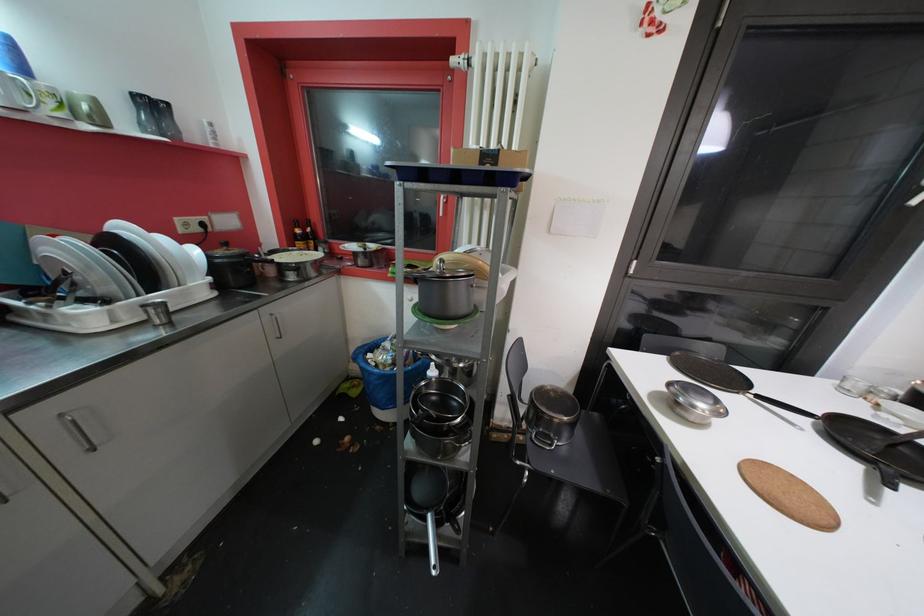
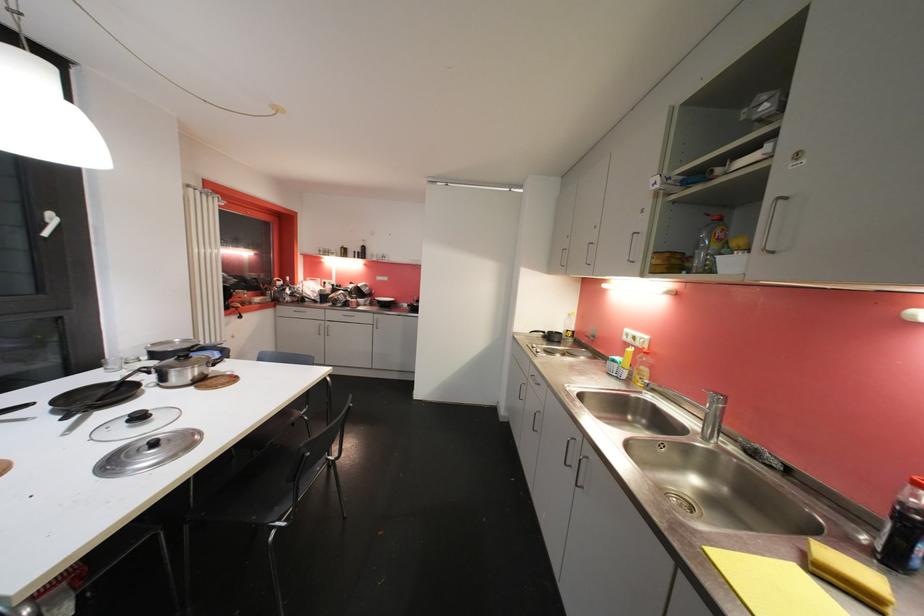
Based on the continuous images, in which direction is the camera rotating?

The camera rotated toward right-down.